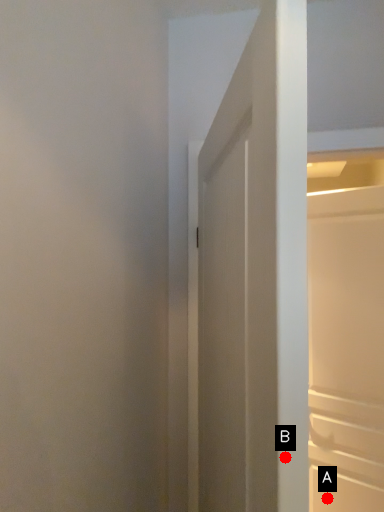
Question: Two points are circled on the image, labeled by A and B beside each circle. Among these points, which one is nearest to the camera?

Choices:
 (A) A is closer
 (B) B is closer

Answer: (B)